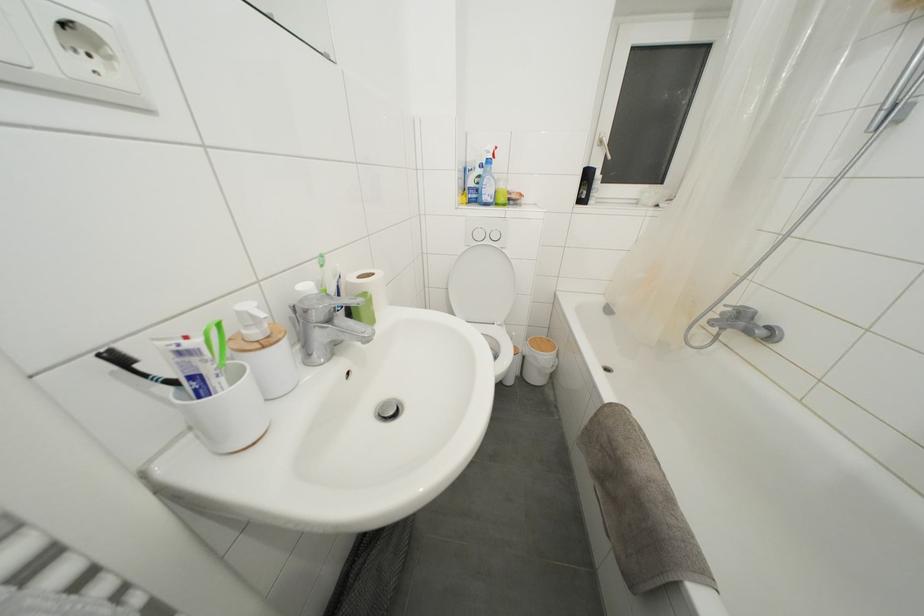
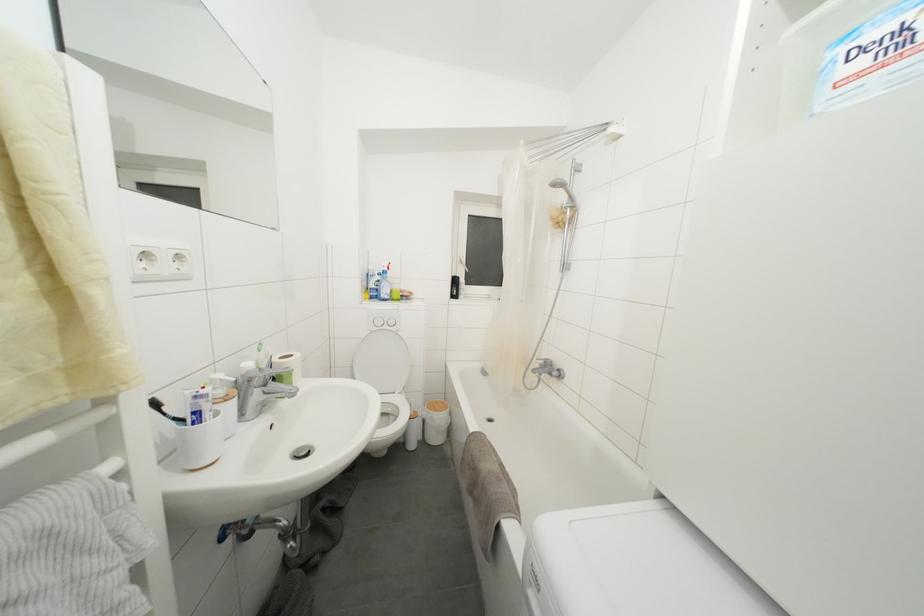
Where in the second image is the point corresponding to point (478, 201) from the first image?

(379, 300)